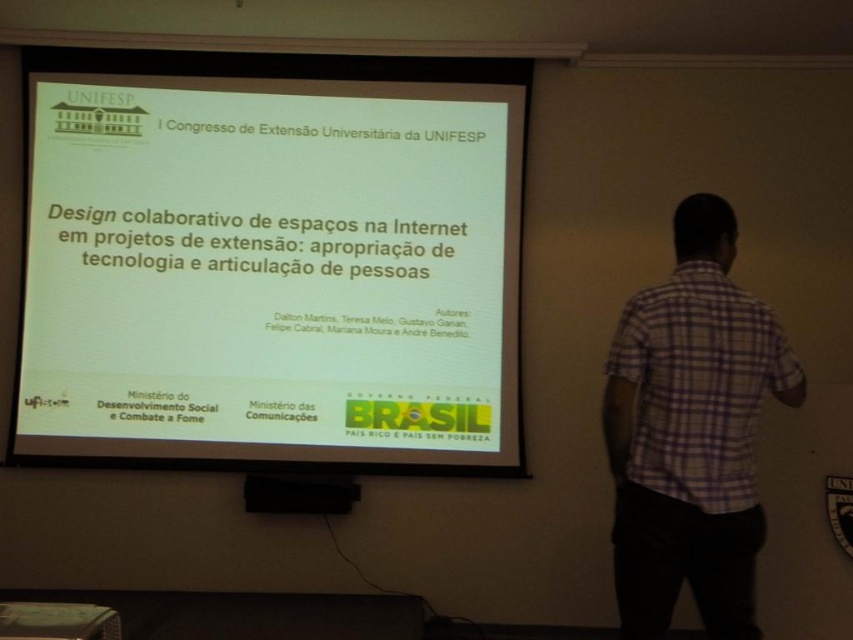
Is white matte projector screen at center shorter than purple checkered shirt at right?

No.

Who is taller, white matte projector screen at center or purple checkered shirt at right?

With more height is white matte projector screen at center.

Who is more distant from viewer, (198, 134) or (697, 342)?

The point (198, 134) is behind.

Identify the location of white matte projector screen at center. (271, 262).